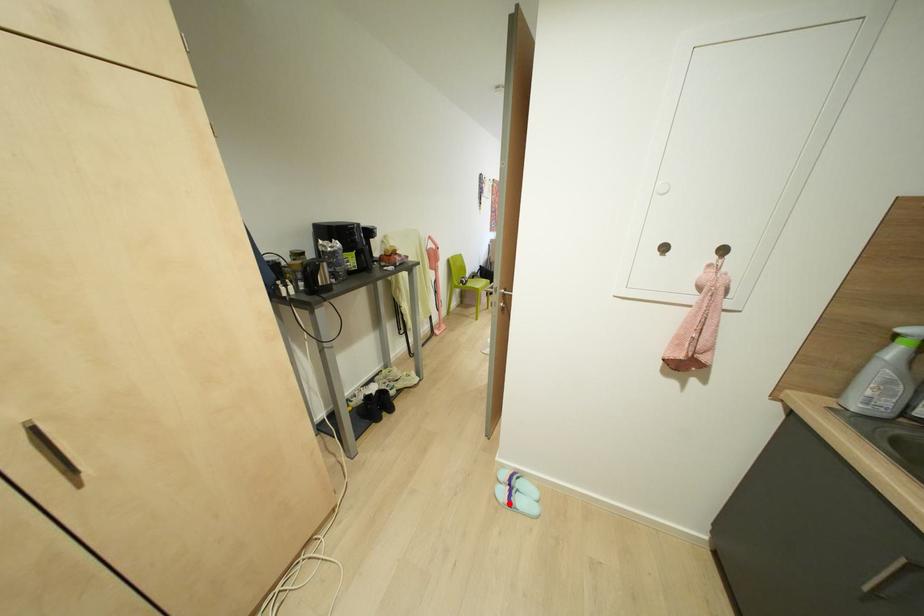
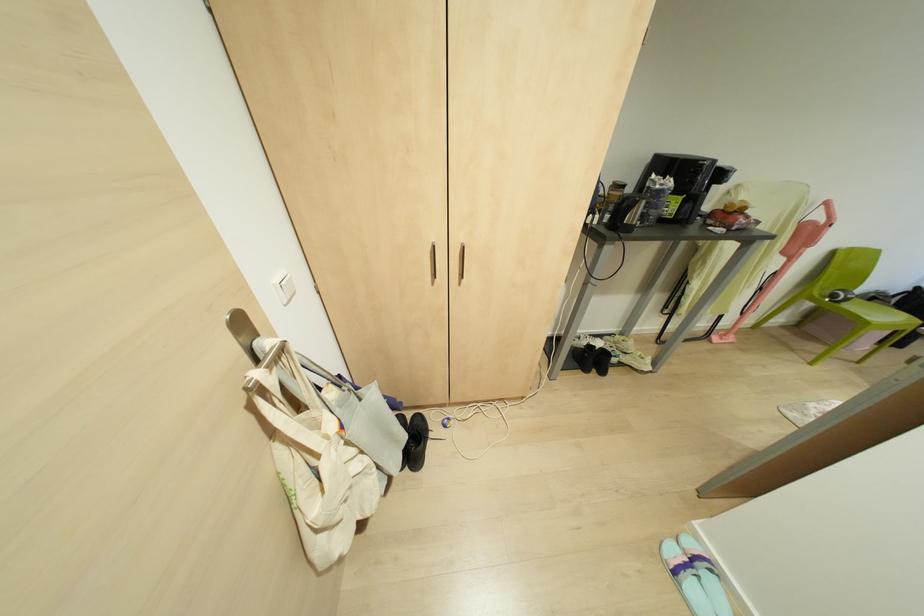
Question: I am providing you with two images of the same scene from different viewpoints. Image1 has a red point marked. In image2, the corresponding 3D location appears at what relative position? Reply with the corresponding letter.

Choices:
 (A) Closer
 (B) Farther

Answer: (A)